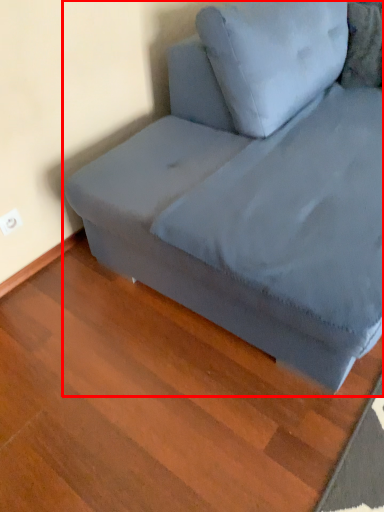
Question: From the image's perspective, considering the relative positions of studio couch (annotated by the red box) and pillow in the image provided, where is studio couch (annotated by the red box) located with respect to the staircase?

Choices:
 (A) below
 (B) above

Answer: (A)